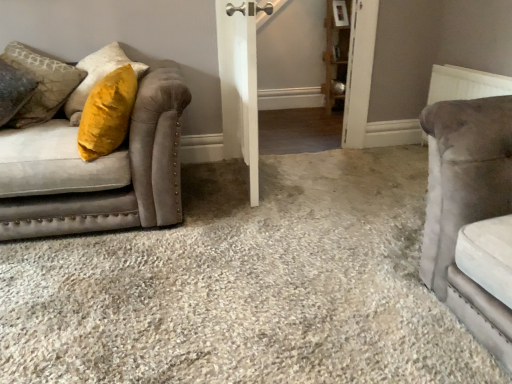
Question: From a real-world perspective, is white textured radiator at upper right physically located above or below wooden shelf at upper right?

Choices:
 (A) below
 (B) above

Answer: (A)

Question: Is white textured radiator at upper right inside or outside of wooden shelf at upper right?

Choices:
 (A) inside
 (B) outside

Answer: (B)

Question: Which of these objects is positioned closest to the velvet gray couch at left?

Choices:
 (A) white wooden barn door at center
 (B) wooden shelf at upper right
 (C) velvet yellow pillow at left
 (D) white textured radiator at upper right

Answer: (C)

Question: Estimate the real-world distances between objects in this image. Which object is farther from the velvet yellow pillow at left?

Choices:
 (A) white textured radiator at upper right
 (B) wooden shelf at upper right
 (C) velvet gray couch at left
 (D) white wooden barn door at center

Answer: (B)